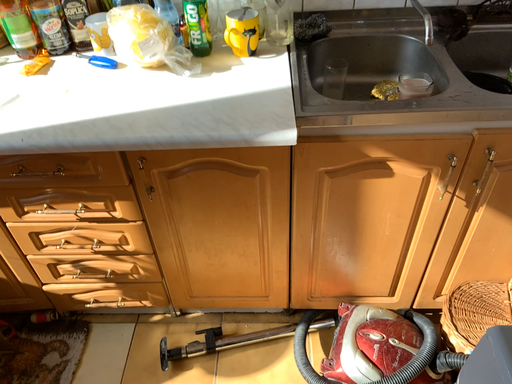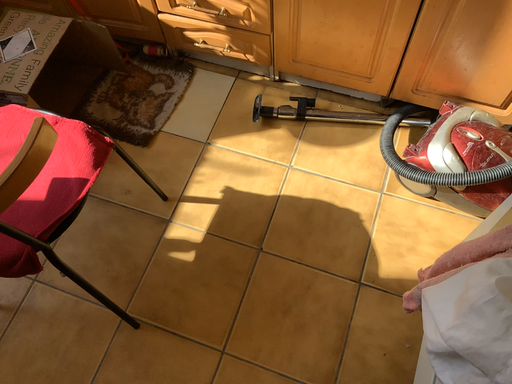
Question: Which way did the camera rotate in the video?

Choices:
 (A) rotated upward
 (B) rotated downward

Answer: (B)